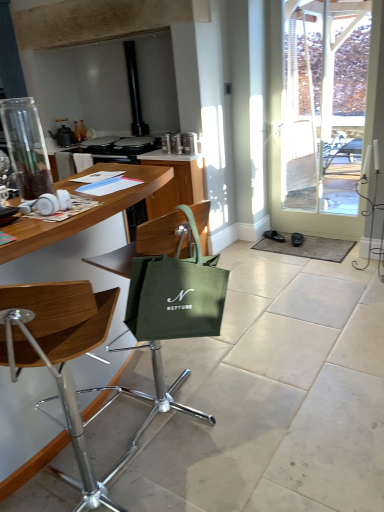
Locate an element on the screen. The width and height of the screenshot is (384, 512). vacant area on the back side of green fabric bag at center, acting as the 1th chair starting from the back is located at coordinates 186,358.